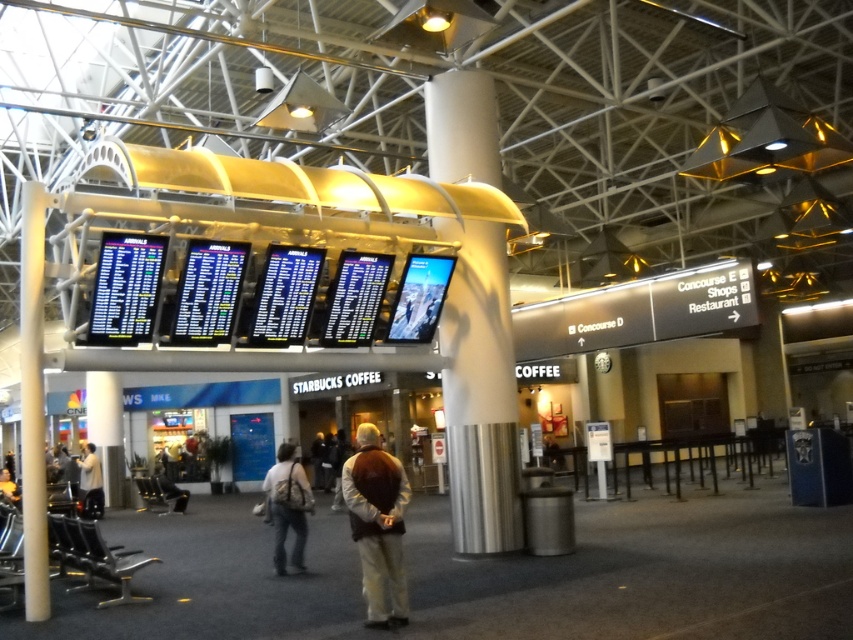
Is point (454, 396) farther from camera compared to point (310, 497)?

Yes.

Is point (453, 70) closer to camera compared to point (289, 525)?

No.

The height and width of the screenshot is (640, 853). Describe the element at coordinates (480, 392) in the screenshot. I see `white glossy pillar at center` at that location.

The width and height of the screenshot is (853, 640). I want to click on white glossy pillar at center, so click(x=480, y=392).

Is brown suede jacket at center further to camera compared to light beige shirt at lower left?

No, brown suede jacket at center is in front of light beige shirt at lower left.

Is brown suede jacket at center shorter than light beige shirt at lower left?

Yes.

Is point (376, 433) positioned behind point (85, 456)?

No, (376, 433) is in front of (85, 456).

The image size is (853, 640). Identify the location of brown suede jacket at center. (376, 525).

Is point (460, 100) more distant than point (102, 486)?

That is False.

Does white glossy pillar at center appear over light beige shirt at lower left?

Yes.

Measure the distance between point (479, 333) and camera.

Point (479, 333) is 38.58 feet away from camera.

Locate an element on the screen. The height and width of the screenshot is (640, 853). white glossy pillar at center is located at coordinates (480, 392).